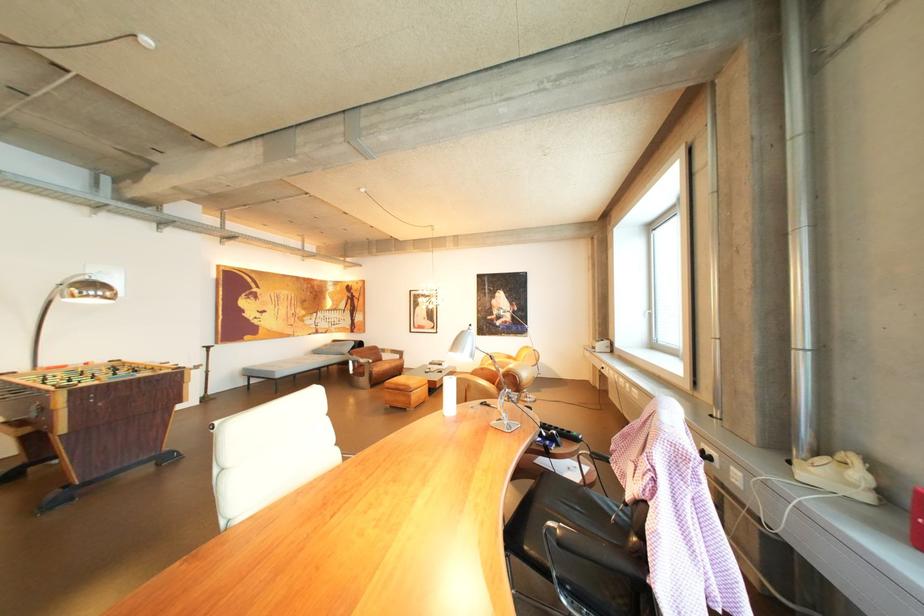
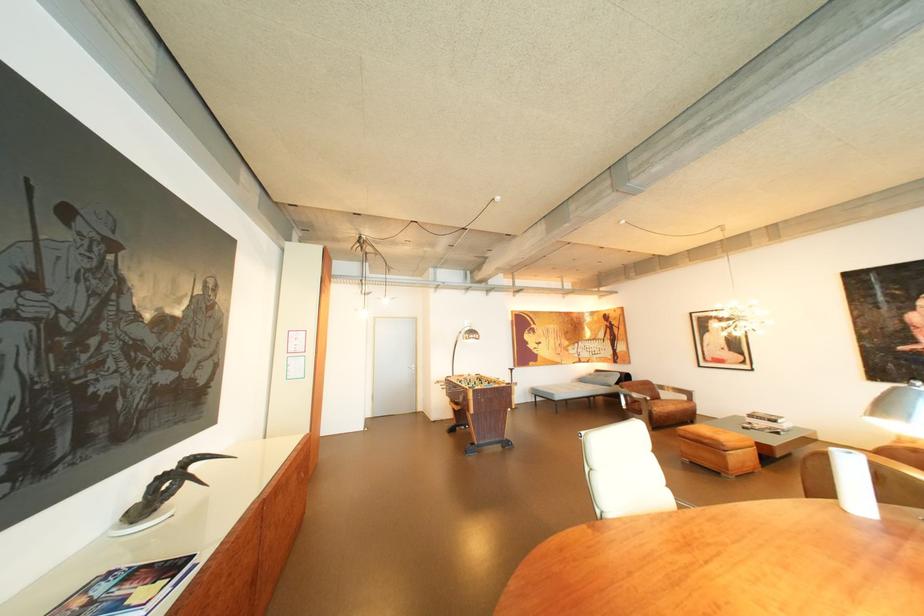
The point at (393, 360) is marked in the first image. Where is the corresponding point in the second image?

(671, 399)